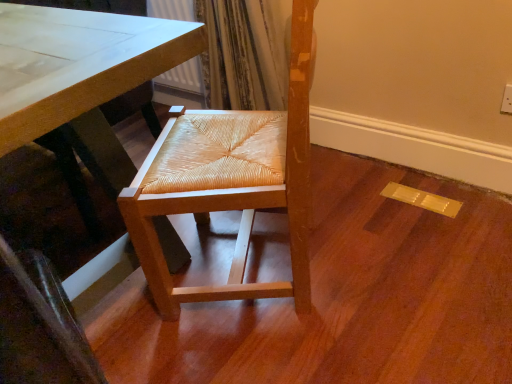
Question: Considering the positions of natural wood woven seat at center and matte white table at center in the image, is natural wood woven seat at center wider or thinner than matte white table at center?

Choices:
 (A) thin
 (B) wide

Answer: (A)

Question: From the image's perspective, is natural wood woven seat at center positioned above or below matte white table at center?

Choices:
 (A) above
 (B) below

Answer: (B)

Question: Which object is positioned closest to the natural wood woven seat at center?

Choices:
 (A) matte white table at center
 (B) natural wood chair at center

Answer: (A)

Question: Which object is the closest to the natural wood woven seat at center?

Choices:
 (A) natural wood chair at center
 (B) matte white table at center

Answer: (B)